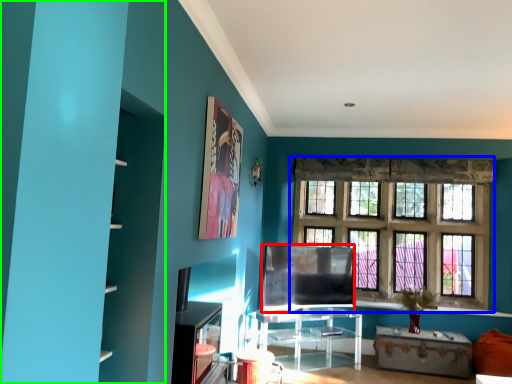
Question: Which is nearer to the window screen (highlighted by a red box)? window (highlighted by a blue box) or bookshelf (highlighted by a green box).

Choices:
 (A) window
 (B) bookshelf

Answer: (A)